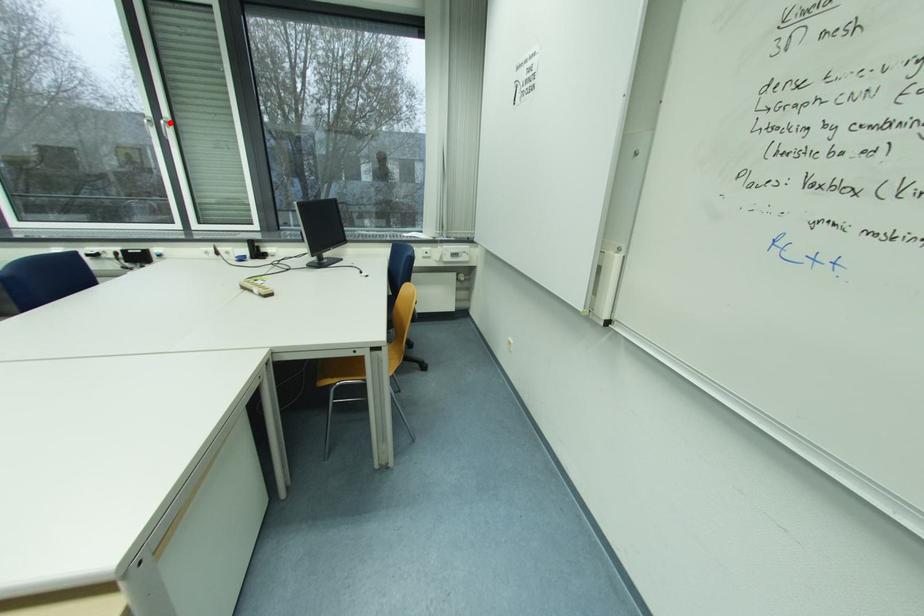
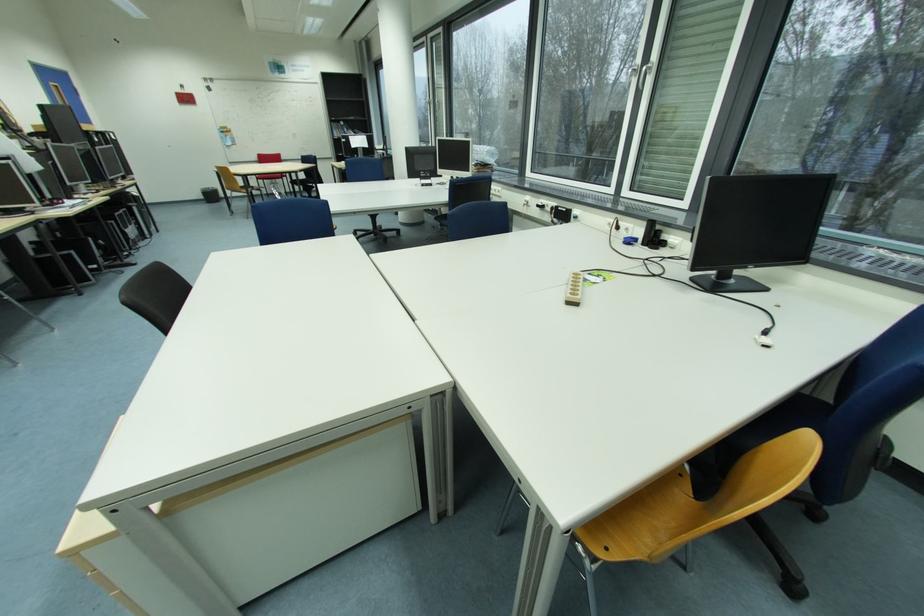
Where in the second image is the point corresponding to the highlighted location from the first image?

(651, 69)